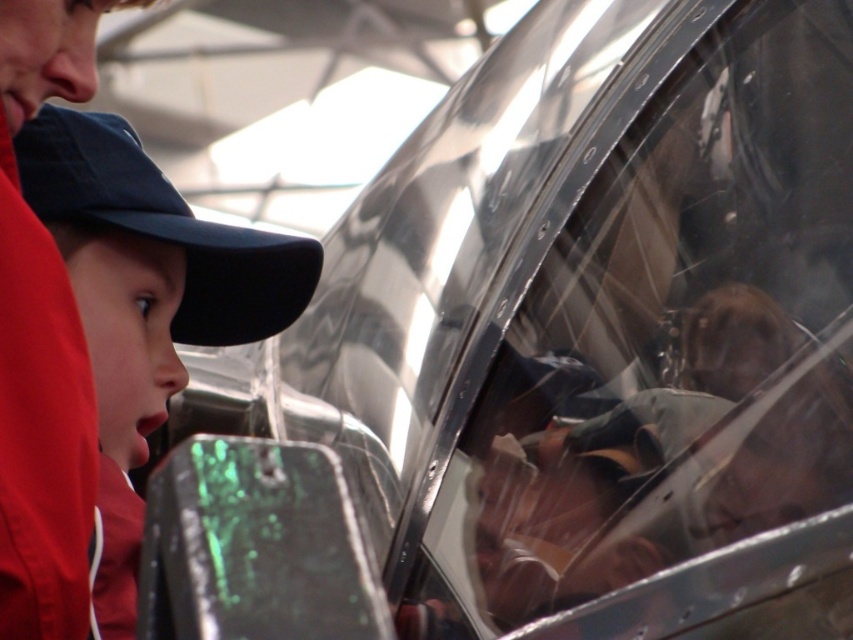
Can you confirm if dark blue fabric baseball cap at left is taller than matte black nose at left?

Yes.

The height and width of the screenshot is (640, 853). What do you see at coordinates (165, 227) in the screenshot?
I see `dark blue fabric baseball cap at left` at bounding box center [165, 227].

You are a GUI agent. You are given a task and a screenshot of the screen. Output one action in this format:
    pyautogui.click(x=<x>, y=<y>)
    Task: Click on the dark blue fabric baseball cap at left
    
    Given the screenshot: What is the action you would take?
    pyautogui.click(x=165, y=227)

Consider the image. Can you confirm if matte skin nose at upper left is positioned to the right of matte black nose at left?

In fact, matte skin nose at upper left is to the left of matte black nose at left.

Consider the image. Does matte skin nose at upper left have a lesser width compared to matte black nose at left?

In fact, matte skin nose at upper left might be wider than matte black nose at left.

This screenshot has height=640, width=853. What do you see at coordinates (68, 52) in the screenshot?
I see `matte skin nose at upper left` at bounding box center [68, 52].

This screenshot has height=640, width=853. Find the location of `matte skin nose at upper left`. matte skin nose at upper left is located at coordinates (68, 52).

Is dark blue fabric baseball cap at left to the right of matte skin nose at upper left from the viewer's perspective?

Yes, dark blue fabric baseball cap at left is to the right of matte skin nose at upper left.

Between dark blue fabric baseball cap at left and matte skin nose at upper left, which one appears on the left side from the viewer's perspective?

matte skin nose at upper left

Does point (165, 205) come farther from viewer compared to point (59, 83)?

Yes, it is.

Identify the location of dark blue fabric baseball cap at left. (165, 227).